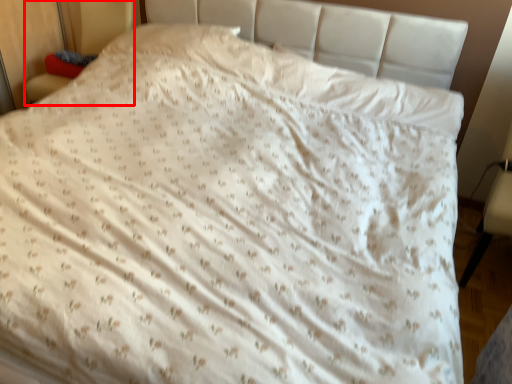
Question: From the image's perspective, what is the correct spatial positioning of armchair (annotated by the red box) in reference to armchair?

Choices:
 (A) above
 (B) below

Answer: (A)